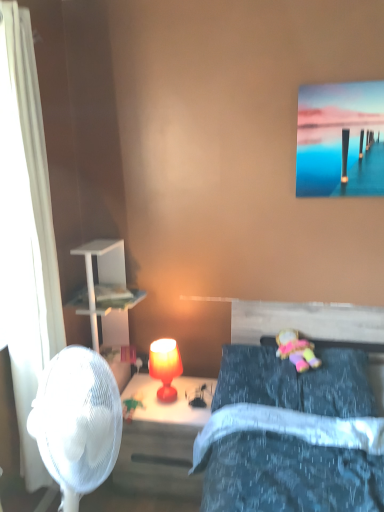
Question: Considering the positions of matte red lamp at center and velvet blue pillow at lower right in the image, is matte red lamp at center taller or shorter than velvet blue pillow at lower right?

Choices:
 (A) tall
 (B) short

Answer: (A)

Question: Based on their sizes in the image, would you say matte red lamp at center is bigger or smaller than velvet blue pillow at lower right?

Choices:
 (A) big
 (B) small

Answer: (A)

Question: Which object is the closest to the matte orange lamp at center?

Choices:
 (A) plush fabric doll at center
 (B) matte red lamp at center
 (C) white sheer curtain at left
 (D) velvet blue pillow at lower right

Answer: (B)

Question: Which is farther from the white sheer curtain at left?

Choices:
 (A) matte orange lamp at center
 (B) matte red lamp at center
 (C) plush fabric doll at center
 (D) velvet blue pillow at lower right

Answer: (C)